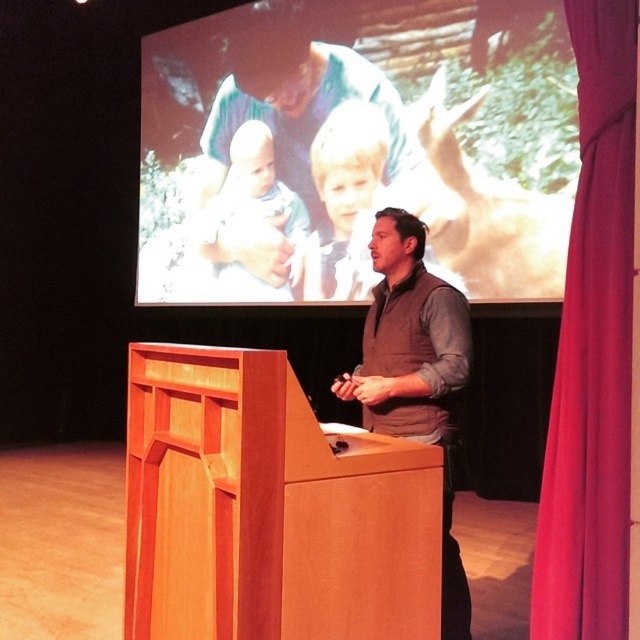
What do you see at coordinates (356, 147) in the screenshot? I see `matte plastic screen at upper center` at bounding box center [356, 147].

This screenshot has height=640, width=640. In order to click on matte plastic screen at upper center in this screenshot , I will do `click(356, 147)`.

Is point (374, 397) behind point (248, 291)?

No, it is not.

Between brown vest at center and smooth white baby at center, which one appears on the left side from the viewer's perspective?

smooth white baby at center

The image size is (640, 640). In order to click on brown vest at center in this screenshot , I will do pyautogui.click(x=416, y=372).

What do you see at coordinates (356, 147) in the screenshot?
I see `matte plastic screen at upper center` at bounding box center [356, 147].

Can you confirm if matte plastic screen at upper center is positioned to the right of light blonde hair at upper center?

No, matte plastic screen at upper center is not to the right of light blonde hair at upper center.

At what (x,y) coordinates should I click in order to perform the action: click on matte plastic screen at upper center. Please return your answer as a coordinate pair (x, y). The width and height of the screenshot is (640, 640). Looking at the image, I should click on (356, 147).